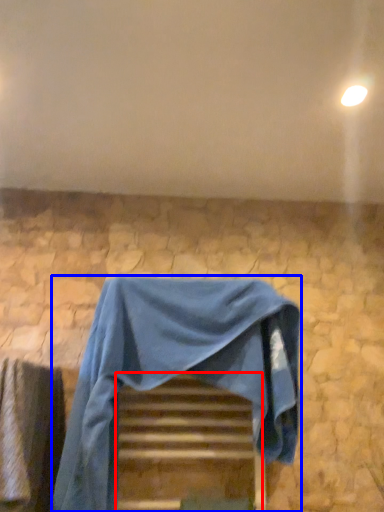
Question: Which of the following is the closest to the observer, stairwell (highlighted by a red box) or furniture (highlighted by a blue box)?

Choices:
 (A) stairwell
 (B) furniture

Answer: (B)